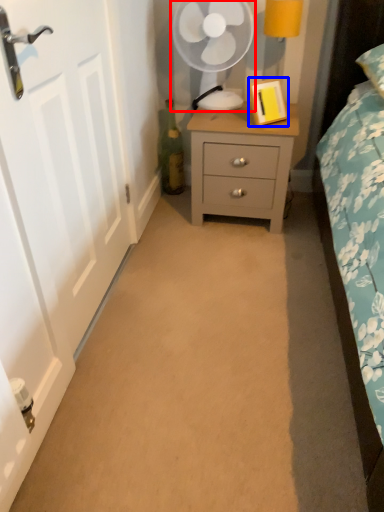
Question: Which of the following is the closest to the observer, mechanical fan (highlighted by a red box) or picture frame (highlighted by a blue box)?

Choices:
 (A) mechanical fan
 (B) picture frame

Answer: (B)